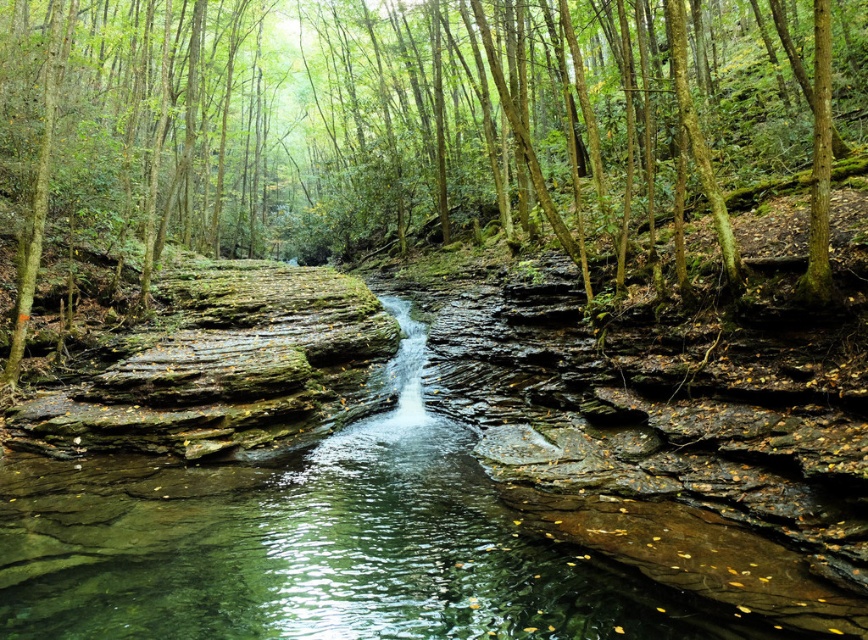
Does point (382, 35) come farther from viewer compared to point (492, 538)?

That is True.

Who is higher up, green mossy rock at center or clear stone waterfall at center?

green mossy rock at center

Between point (220, 241) and point (610, 577), which one is positioned in front?

Positioned in front is point (610, 577).

This screenshot has height=640, width=868. What are the coordinates of `green mossy rock at center` in the screenshot? It's located at (380, 122).